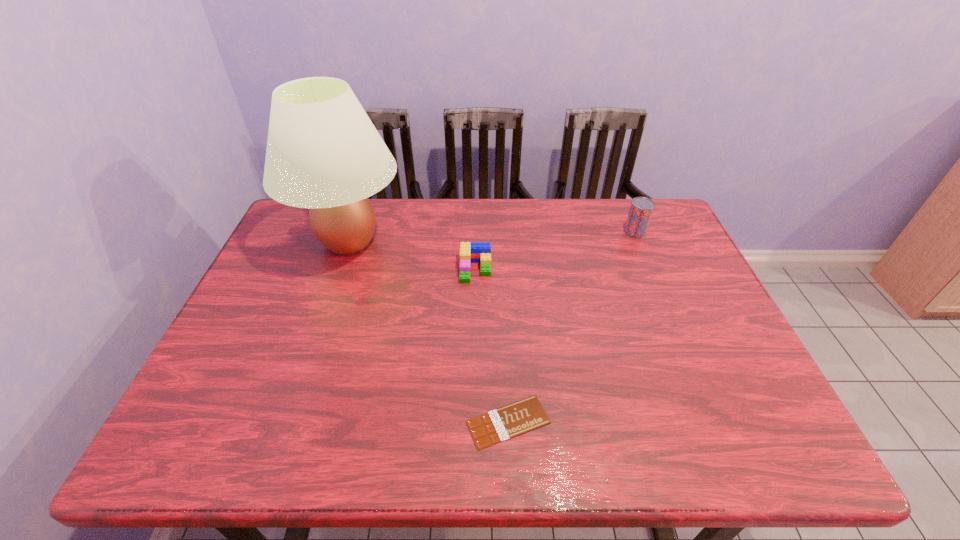
What are the coordinates of `free point between the leftmost object and the rightmost object` in the screenshot? It's located at (492, 237).

At what (x,y) coordinates should I click in order to perform the action: click on vacant space that's between the second shortest object and the beer can. Please return your answer as a coordinate pair (x, y). The width and height of the screenshot is (960, 540). Looking at the image, I should click on (556, 251).

The image size is (960, 540). I want to click on free space between the Lego and the nearest object, so click(x=492, y=346).

I want to click on object that is the nearest to the third tallest object, so click(x=323, y=152).

Identify which object is the third closest to the second tallest object. Please provide its 2D coordinates. Your answer should be formatted as a tuple, i.e. [(x, y)], where the tuple contains the x and y coordinates of a point satisfying the conditions above.

[(323, 152)]

At what (x,y) coordinates should I click in order to perform the action: click on free region that satisfies the following two spatial constraints: 1. on the shade of the leftmost object; 2. on the back side of the chocolate bar. Please return your answer as a coordinate pair (x, y). The image size is (960, 540). Looking at the image, I should click on (286, 422).

The height and width of the screenshot is (540, 960). What are the coordinates of `vacant space that satisfies the following two spatial constraints: 1. on the shade of the second shortest object; 2. on the left side of the tallest object` in the screenshot? It's located at pos(339,269).

Identify the location of vacant space that satisfies the following two spatial constraints: 1. on the shade of the lampshade; 2. on the right side of the second shortest object. (339, 269).

Identify the location of vacant space that satisfies the following two spatial constraints: 1. on the shade of the tallest object; 2. on the right side of the chocolate bar. (286, 422).

At what (x,y) coordinates should I click in order to perform the action: click on free region that satisfies the following two spatial constraints: 1. on the shade of the nearest object; 2. on the left side of the leftmost object. Please return your answer as a coordinate pair (x, y). The height and width of the screenshot is (540, 960). Looking at the image, I should click on (286, 422).